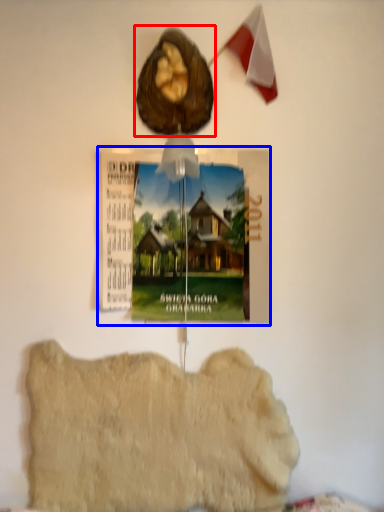
Question: Which of the following is the farthest to the observer, animal (highlighted by a red box) or postcard (highlighted by a blue box)?

Choices:
 (A) animal
 (B) postcard

Answer: (B)